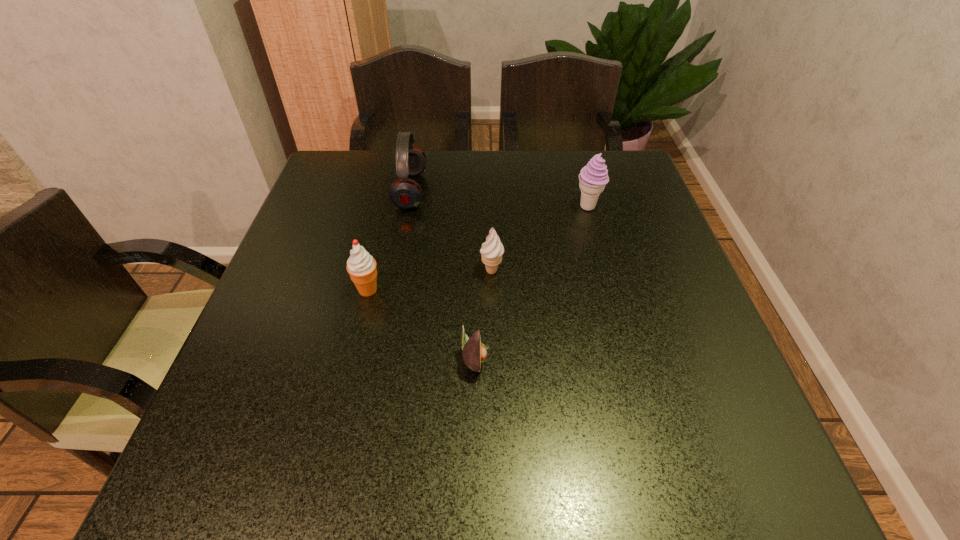
Locate an element on the screen. earphone is located at coordinates (405, 193).

The width and height of the screenshot is (960, 540). I want to click on the farthest icecream, so click(593, 177).

This screenshot has width=960, height=540. What are the coordinates of `the rightmost icecream` in the screenshot? It's located at (593, 177).

The image size is (960, 540). In order to click on the nearest icecream in this screenshot , I will do `click(361, 266)`.

You are a GUI agent. You are given a task and a screenshot of the screen. Output one action in this format:
    pyautogui.click(x=<x>, y=<y>)
    Task: Click on the fourth farthest object
    The image size is (960, 540).
    Given the screenshot: What is the action you would take?
    pyautogui.click(x=361, y=266)

You are a GUI agent. You are given a task and a screenshot of the screen. Output one action in this format:
    pyautogui.click(x=<x>, y=<y>)
    Task: Click on the second icecream from right to left
    The image size is (960, 540).
    Given the screenshot: What is the action you would take?
    pyautogui.click(x=492, y=250)

In order to click on the third nearest object in this screenshot , I will do `click(492, 250)`.

Locate an element on the screen. avocado is located at coordinates (474, 352).

Where is `the shortest object`? The width and height of the screenshot is (960, 540). the shortest object is located at coordinates (474, 352).

The width and height of the screenshot is (960, 540). Find the location of `vacant space situated on the ear cups of the earphone`. vacant space situated on the ear cups of the earphone is located at coordinates (502, 191).